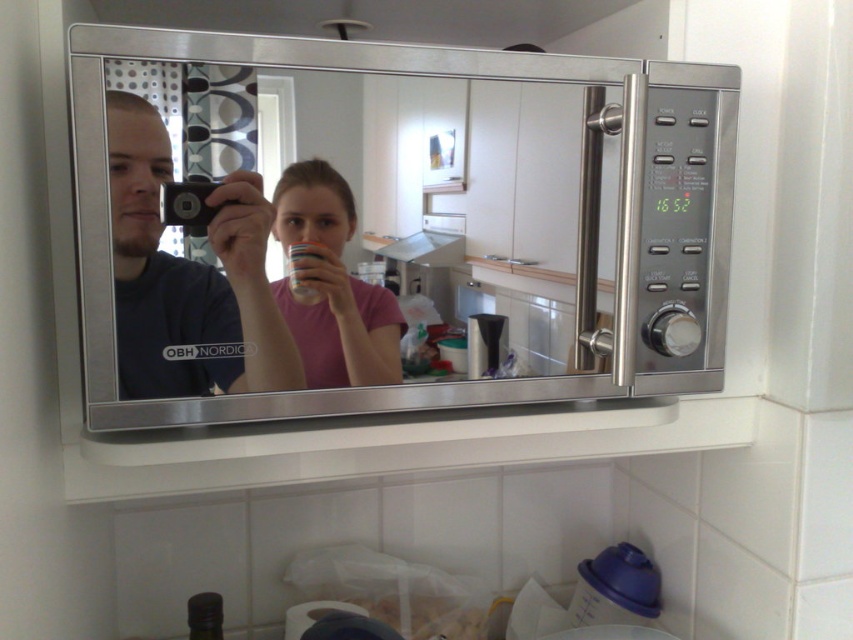
Does matte black camera at center have a lesser height compared to white matte cup at upper center?

Incorrect, matte black camera at center's height does not fall short of white matte cup at upper center's.

Which is behind, point (123, 161) or point (305, 296)?

Positioned behind is point (305, 296).

At what (x,y) coordinates should I click in order to perform the action: click on matte black camera at center. Please return your answer as a coordinate pair (x, y). The height and width of the screenshot is (640, 853). Looking at the image, I should click on (189, 275).

Between point (138, 298) and point (306, 346), which one is positioned in front?

Positioned in front is point (138, 298).

Can you confirm if matte black camera at center is positioned below pink matte shirt at center?

Actually, matte black camera at center is above pink matte shirt at center.

Who is more forward, (259, 182) or (347, 310)?

Positioned in front is point (259, 182).

Locate an element on the screen. The width and height of the screenshot is (853, 640). matte black camera at center is located at coordinates (189, 275).

Is pink matte shirt at center smaller than white matte cup at upper center?

Incorrect, pink matte shirt at center is not smaller in size than white matte cup at upper center.

Locate an element on the screen. The image size is (853, 640). pink matte shirt at center is located at coordinates (332, 285).

You are a GUI agent. You are given a task and a screenshot of the screen. Output one action in this format:
    pyautogui.click(x=<x>, y=<y>)
    Task: Click on the pink matte shirt at center
    This screenshot has width=853, height=640.
    Given the screenshot: What is the action you would take?
    pyautogui.click(x=332, y=285)